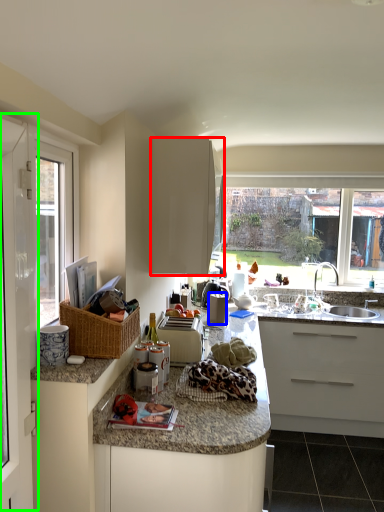
Question: Estimate the real-world distances between objects in this image. Which object is closer to cabinetry (highlighted by a red box), appliance (highlighted by a blue box) or screen door (highlighted by a green box)?

Choices:
 (A) appliance
 (B) screen door

Answer: (A)